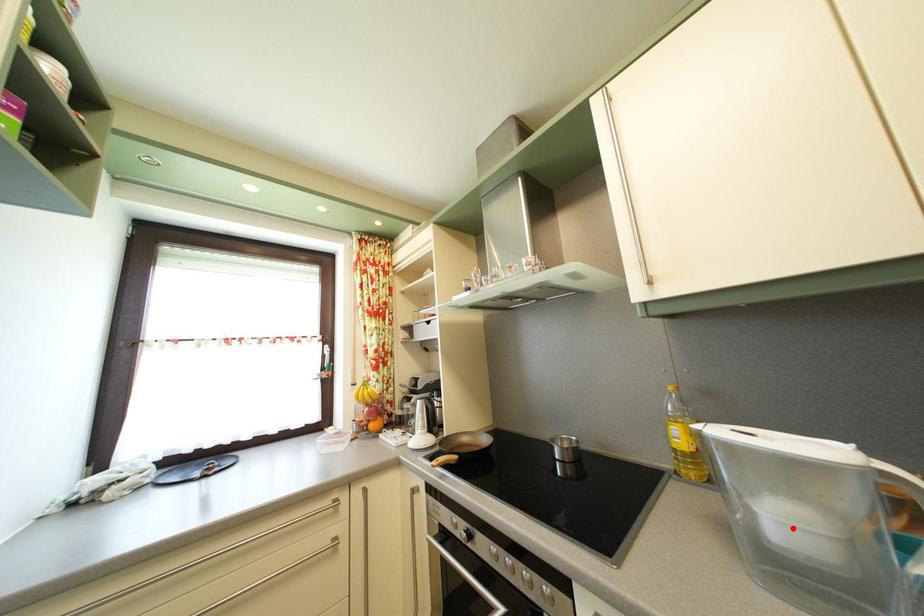
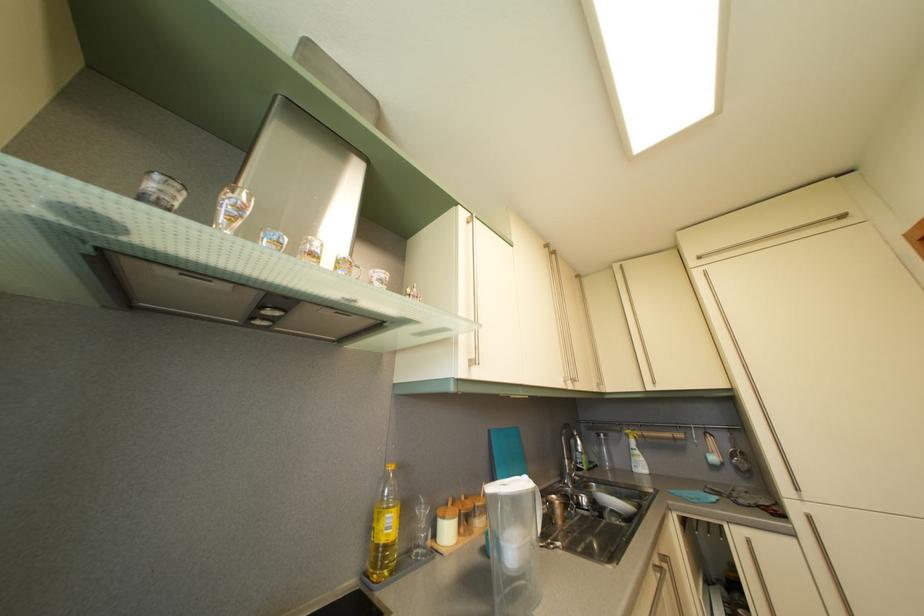
Question: I am providing you with two images of the same scene from different viewpoints. Given a red point in image1, look at the same physical point in image2. Is it:

Choices:
 (A) Closer to the viewpoint
 (B) Farther from the viewpoint

Answer: (B)